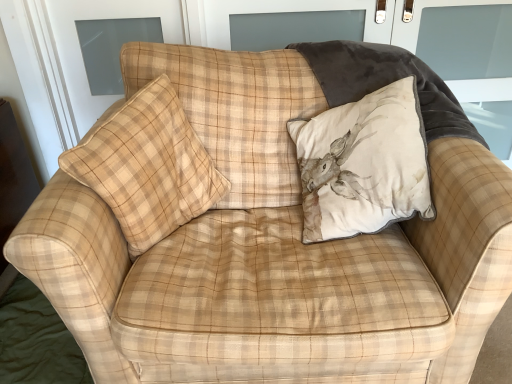
Question: Based on their positions, is velvet screen door at upper right located to the left or right of beige velvet cushion with deer print at upper right, acting as the 2th pillow starting from the left?

Choices:
 (A) left
 (B) right

Answer: (B)

Question: Is velvet screen door at upper right inside or outside of beige velvet cushion with deer print at upper right, the first pillow viewed from the right?

Choices:
 (A) inside
 (B) outside

Answer: (B)

Question: Estimate the real-world distances between objects in this image. Which object is closer to the beige plaid pillow at center, placed as the first pillow when sorted from left to right?

Choices:
 (A) velvet screen door at upper right
 (B) beige velvet cushion with deer print at upper right, the first pillow viewed from the right

Answer: (B)

Question: Which is farther from the beige velvet cushion with deer print at upper right, the first pillow viewed from the right?

Choices:
 (A) velvet screen door at upper right
 (B) beige plaid pillow at center, placed as the first pillow when sorted from left to right

Answer: (A)